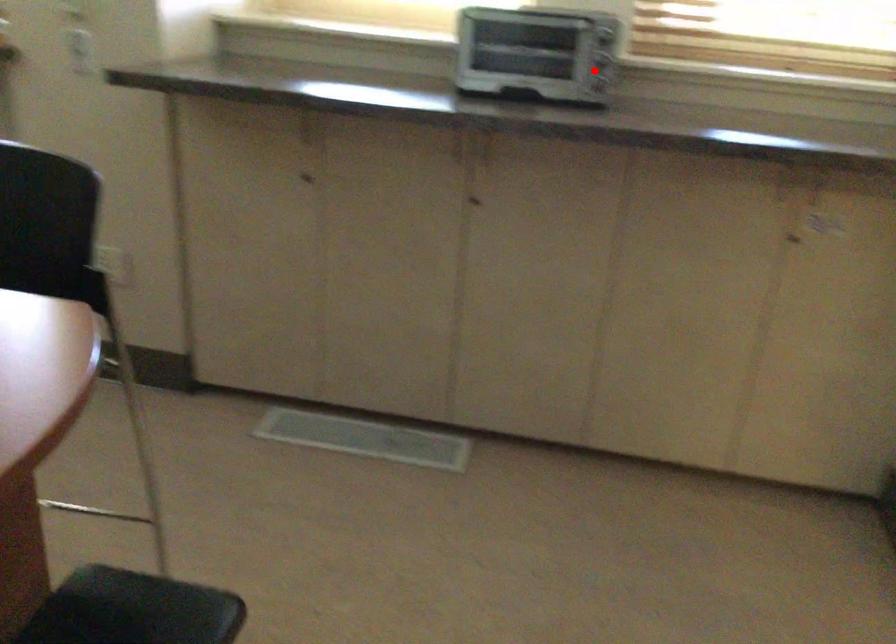
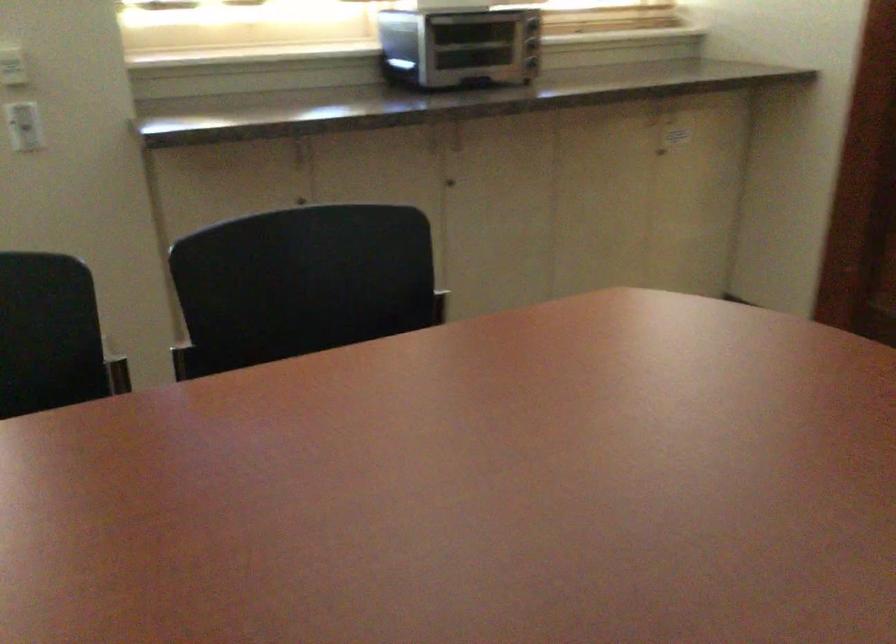
Question: A red point is marked in image1. In image2, is the corresponding 3D point closer to the camera or farther? Reply with the corresponding letter.

Choices:
 (A) The corresponding 3D point is closer.
 (B) The corresponding 3D point is farther.

Answer: (B)